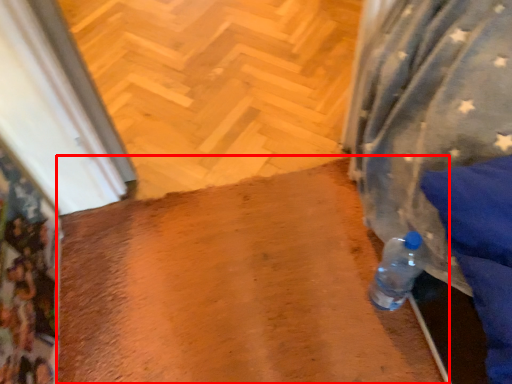
Question: From the image's perspective, considering the relative positions of wide (annotated by the red box) and path in the image provided, where is wide (annotated by the red box) located with respect to the staircase?

Choices:
 (A) above
 (B) below

Answer: (B)